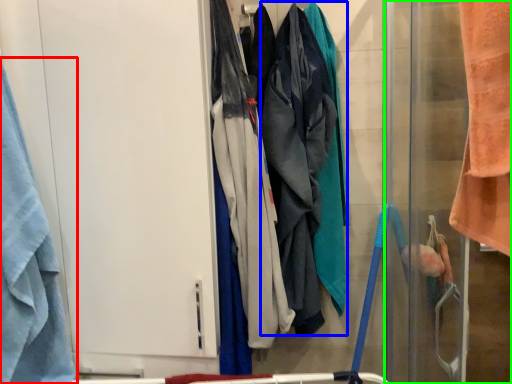
Question: Considering the real-world distances, which object is farthest from towel (highlighted by a red box)? wide (highlighted by a blue box) or screen door (highlighted by a green box)?

Choices:
 (A) wide
 (B) screen door

Answer: (B)